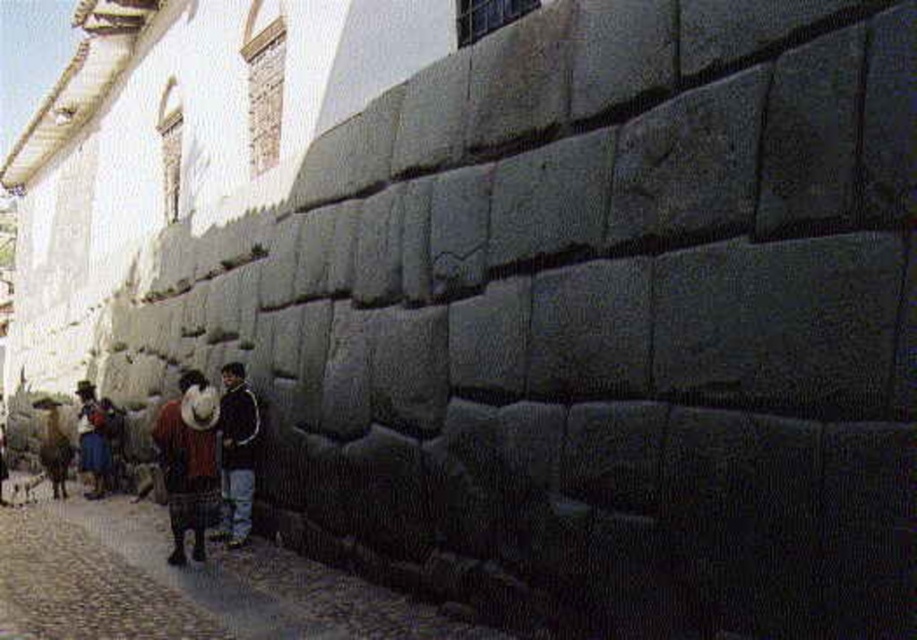
Is dark gray stone wall at lower left closer to the viewer compared to blue woven fabric at lower left?

That is True.

Can you confirm if dark gray stone wall at lower left is positioned below blue woven fabric at lower left?

Indeed, dark gray stone wall at lower left is positioned under blue woven fabric at lower left.

Who is more distant from viewer, (151, 628) or (98, 426)?

Point (98, 426)

I want to click on dark gray stone wall at lower left, so click(x=186, y=582).

Which is behind, point (180, 440) or point (101, 470)?

The point (101, 470) is more distant.

Who is more forward, (173, 556) or (90, 465)?

Point (173, 556) is in front.

The image size is (917, 640). Find the location of `knitted wool sweater at center`. knitted wool sweater at center is located at coordinates (185, 468).

This screenshot has height=640, width=917. Find the location of `knitted wool sweater at center`. knitted wool sweater at center is located at coordinates 185,468.

Does dark blue jacket at center come in front of blue woven fabric at lower left?

Yes, it is.

I want to click on dark blue jacket at center, so click(238, 452).